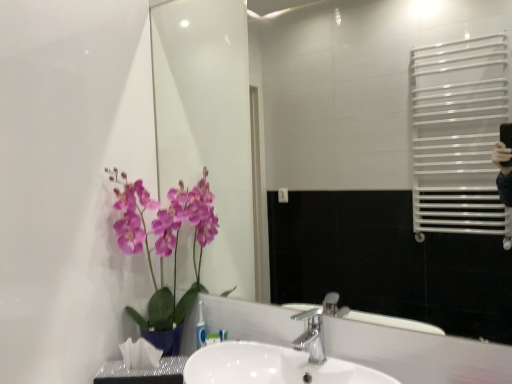
Describe the element at coordinates (278, 361) in the screenshot. I see `white glossy sink at center` at that location.

Describe the element at coordinates (311, 335) in the screenshot. Image resolution: width=512 pixels, height=384 pixels. I see `silver metallic faucet at center` at that location.

You are a GUI agent. You are given a task and a screenshot of the screen. Output one action in this format:
    pyautogui.click(x=<x>, y=<y>)
    Task: Click on the transparent glass mirror at upper center
    The width and height of the screenshot is (512, 384).
    Given the screenshot: What is the action you would take?
    (344, 152)

The width and height of the screenshot is (512, 384). What do you see at coordinates (165, 251) in the screenshot?
I see `purple silk orchid at left` at bounding box center [165, 251].

Identify the location of white glossy sink at center. (278, 361).

Is white glossy sink at center at the right side of transparent glass mirror at upper center?

In fact, white glossy sink at center is to the left of transparent glass mirror at upper center.

From the image's perspective, who appears lower, white glossy sink at center or transparent glass mirror at upper center?

white glossy sink at center is shown below in the image.

Would you consider white glossy sink at center to be distant from transparent glass mirror at upper center?

Absolutely, white glossy sink at center is distant from transparent glass mirror at upper center.

From a real-world perspective, which object stands above the other?

From a 3D spatial view, transparent glass mirror at upper center is above.

Is transparent glass mirror at upper center to the right of white glossy sink at center from the viewer's perspective?

Indeed, transparent glass mirror at upper center is positioned on the right side of white glossy sink at center.

In terms of width, does transparent glass mirror at upper center look wider or thinner when compared to white glossy sink at center?

In the image, transparent glass mirror at upper center appears to be more narrow than white glossy sink at center.

What's the angular difference between transparent glass mirror at upper center and white glossy sink at center's facing directions?

The angle between the facing direction of transparent glass mirror at upper center and the facing direction of white glossy sink at center is 0.174 degrees.

Is transparent glass mirror at upper center oriented towards white glossy sink at center?

No, transparent glass mirror at upper center is not aimed at white glossy sink at center.

From the image's perspective, is white glossy sink at center above or below silver metallic faucet at center?

Based on their image positions, white glossy sink at center is located beneath silver metallic faucet at center.

How much distance is there between white glossy sink at center and silver metallic faucet at center?

white glossy sink at center and silver metallic faucet at center are 4.00 inches apart.

Is silver metallic faucet at center located within white glossy sink at center?

Yes, silver metallic faucet at center can be found within white glossy sink at center.

Which object is thinner, white glossy sink at center or silver metallic faucet at center?

silver metallic faucet at center is thinner.

Is silver metallic faucet at center outside of white glossy sink at center?

silver metallic faucet at center is positioned outside white glossy sink at center.

Find the location of a particular element. This screenshot has height=384, width=512. tap behind the white glossy sink at center is located at coordinates (311, 335).

Considering the relative sizes of silver metallic faucet at center and white glossy sink at center in the image provided, is silver metallic faucet at center bigger than white glossy sink at center?

Incorrect, silver metallic faucet at center is not larger than white glossy sink at center.

How many degrees apart are the facing directions of purple silk orchid at left and transparent glass mirror at upper center?

1.82 degrees.

At what (x,y) coordinates should I click in order to perform the action: click on floral arrangement lying behind the transparent glass mirror at upper center. Please return your answer as a coordinate pair (x, y). The height and width of the screenshot is (384, 512). Looking at the image, I should click on (165, 251).

Is purple silk orchid at left in contact with transparent glass mirror at upper center?

No, purple silk orchid at left is not touching transparent glass mirror at upper center.

Considering the relative sizes of transparent glass mirror at upper center and silver metallic faucet at center in the image provided, is transparent glass mirror at upper center thinner than silver metallic faucet at center?

Yes, transparent glass mirror at upper center is thinner than silver metallic faucet at center.

From the image's perspective, which one is positioned higher, transparent glass mirror at upper center or silver metallic faucet at center?

From the image's view, transparent glass mirror at upper center is above.

From a real-world perspective, is transparent glass mirror at upper center positioned under silver metallic faucet at center based on gravity?

Incorrect, from a real-world perspective, transparent glass mirror at upper center is higher than silver metallic faucet at center.

Is there a large distance between transparent glass mirror at upper center and silver metallic faucet at center?

Indeed, transparent glass mirror at upper center is not near silver metallic faucet at center.

Is purple silk orchid at left placed right next to white glossy sink at center?

No, purple silk orchid at left is not touching white glossy sink at center.

Considering their positions, is purple silk orchid at left located in front of or behind white glossy sink at center?

purple silk orchid at left is behind white glossy sink at center.

Image resolution: width=512 pixels, height=384 pixels. Find the location of `floral arrangement that is on the left side of white glossy sink at center`. floral arrangement that is on the left side of white glossy sink at center is located at coordinates (165, 251).

Considering the sizes of purple silk orchid at left and white glossy sink at center in the image, is purple silk orchid at left taller or shorter than white glossy sink at center?

Considering their sizes, purple silk orchid at left has more height than white glossy sink at center.

The image size is (512, 384). Find the location of `sink below the transparent glass mirror at upper center (from a real-world perspective)`. sink below the transparent glass mirror at upper center (from a real-world perspective) is located at coordinates (278, 361).

The width and height of the screenshot is (512, 384). Identify the location of mirror located behind the white glossy sink at center. (344, 152).

Which object lies nearer to the anchor point silver metallic faucet at center, purple silk orchid at left or transparent glass mirror at upper center?

purple silk orchid at left lies closer to silver metallic faucet at center than the other object.

Based on their spatial positions, is white glossy sink at center or silver metallic faucet at center further from purple silk orchid at left?

silver metallic faucet at center.

From the image, which object appears to be nearer to transparent glass mirror at upper center, silver metallic faucet at center or white glossy sink at center?

Based on the image, silver metallic faucet at center appears to be nearer to transparent glass mirror at upper center.

Considering their positions, is purple silk orchid at left positioned closer to transparent glass mirror at upper center than white glossy sink at center?

purple silk orchid at left lies closer to transparent glass mirror at upper center than the other object.

When comparing their distances from purple silk orchid at left, does silver metallic faucet at center or transparent glass mirror at upper center seem closer?

silver metallic faucet at center is closer to purple silk orchid at left.

Estimate the real-world distances between objects in this image. Which object is closer to white glossy sink at center, transparent glass mirror at upper center or purple silk orchid at left?

Among the two, purple silk orchid at left is located nearer to white glossy sink at center.

Looking at the image, which one is located closer to white glossy sink at center, silver metallic faucet at center or purple silk orchid at left?

silver metallic faucet at center.

Estimate the real-world distances between objects in this image. Which object is closer to transparent glass mirror at upper center, white glossy sink at center or purple silk orchid at left?

Among the two, purple silk orchid at left is located nearer to transparent glass mirror at upper center.

At what (x,y) coordinates should I click in order to perform the action: click on floral arrangement between transparent glass mirror at upper center and white glossy sink at center from top to bottom. Please return your answer as a coordinate pair (x, y). The height and width of the screenshot is (384, 512). Looking at the image, I should click on click(x=165, y=251).

This screenshot has height=384, width=512. I want to click on floral arrangement between transparent glass mirror at upper center and silver metallic faucet at center in the up-down direction, so click(x=165, y=251).

Locate an element on the screen. tap between transparent glass mirror at upper center and white glossy sink at center vertically is located at coordinates (311, 335).

Image resolution: width=512 pixels, height=384 pixels. Identify the location of tap between white glossy sink at center and purple silk orchid at left along the z-axis. (311, 335).